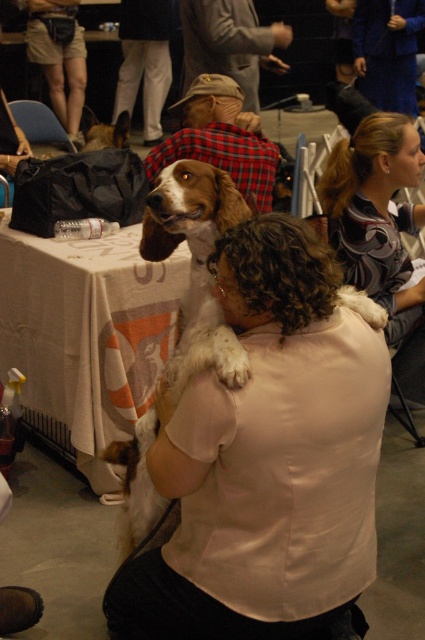
You are a photographer standing at the camera position. You want to take a closeup shot of the brown and white fur at center. Considering your current position, do you need to move closer or farther away to achieve a closer focus on the subject?

The brown and white fur at center is 4.78 feet away from the camera. To achieve a closer focus, you need to move closer to reduce the distance between the camera and the subject.

You are a photographer at the event and want to capture a photo that includes both the brown and white fur at center and the striped fabric shirt at upper right. Based on their positions, which object should you adjust your camera angle to focus on first to ensure both are in frame?

The brown and white fur at center is to the left of the striped fabric shirt at upper right, so you should focus on the brown and white fur at center first to ensure both are in frame.

You are a photographer at the event and want to capture a closeup of the brown and white fur at center. According to the coordinates provided, where should you focus your camera?

You should focus your camera at point (195, 264) to capture the brown and white fur at center.